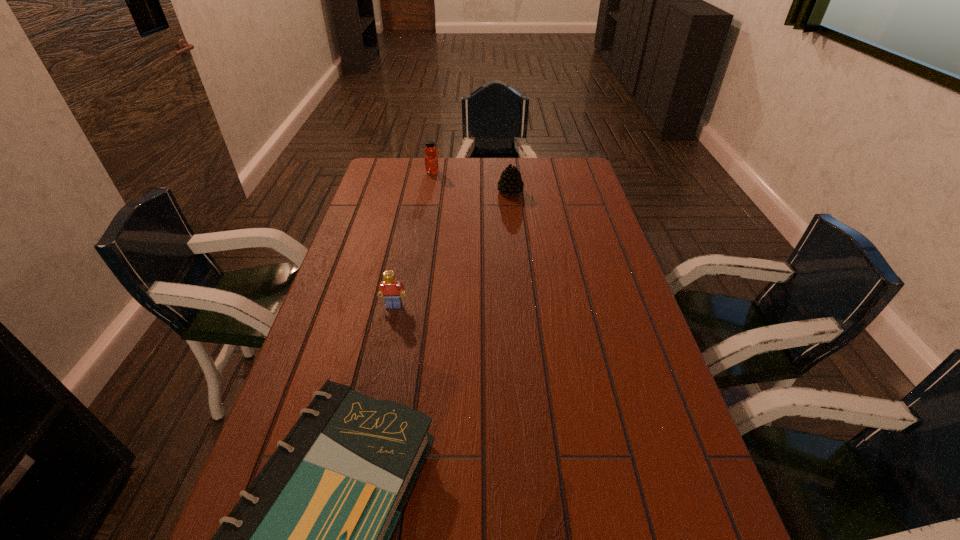
Where is `pinecone that is at the far edge`? The height and width of the screenshot is (540, 960). pinecone that is at the far edge is located at coordinates (510, 183).

This screenshot has width=960, height=540. I want to click on object present at the left edge, so click(x=390, y=288).

This screenshot has width=960, height=540. I want to click on vacant space at the far edge of the desktop, so click(x=431, y=179).

The width and height of the screenshot is (960, 540). In order to click on blank area at the left edge in this screenshot , I will do `click(377, 222)`.

The height and width of the screenshot is (540, 960). Identify the location of blank space at the right edge. (623, 261).

The height and width of the screenshot is (540, 960). I want to click on vacant space at the far left corner of the desktop, so click(x=381, y=159).

At what (x,y) coordinates should I click in order to perform the action: click on vacant space at the far right corner of the desktop. Please return your answer as a coordinate pair (x, y). This screenshot has width=960, height=540. Looking at the image, I should click on (579, 180).

Locate an element on the screen. empty location between the farthest object and the pinecone is located at coordinates (471, 182).

The width and height of the screenshot is (960, 540). What are the coordinates of `free space between the Lego and the farthest object` in the screenshot? It's located at (413, 239).

Identify the location of free spot between the farthest object and the third farthest object. (413, 239).